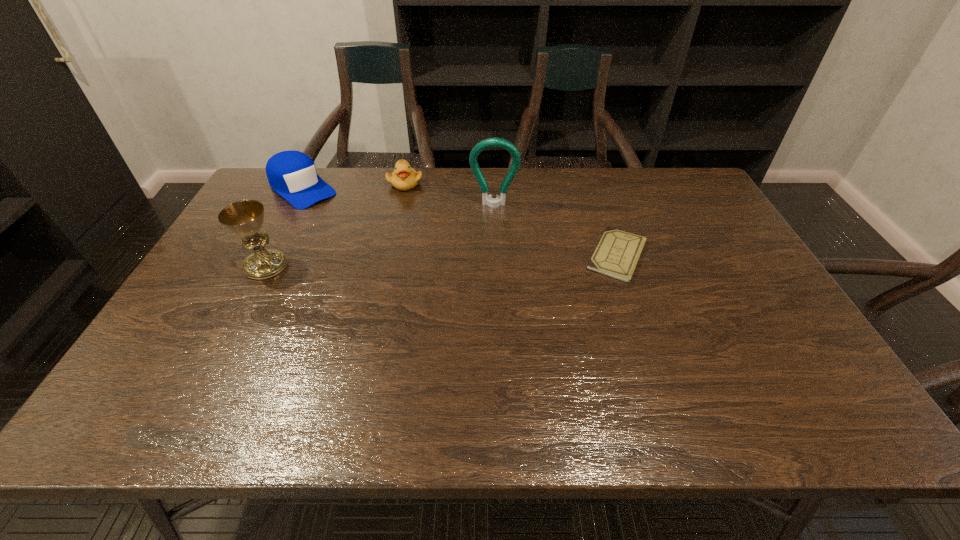
You are a GUI agent. You are given a task and a screenshot of the screen. Output one action in this format:
    pyautogui.click(x=<x>, y=<y>)
    Task: Click on the baseball cap at the far edge
    This screenshot has width=960, height=540.
    Given the screenshot: What is the action you would take?
    pyautogui.click(x=292, y=174)

You are a GUI agent. You are given a task and a screenshot of the screen. Output one action in this format:
    pyautogui.click(x=<x>, y=<y>)
    Task: Click on the bottle opener located at the far edge
    
    Given the screenshot: What is the action you would take?
    pyautogui.click(x=487, y=199)

At what (x,y) coordinates should I click in order to perform the action: click on chalice that is at the left edge. Please return your answer as a coordinate pair (x, y). The width and height of the screenshot is (960, 540). Looking at the image, I should click on (245, 218).

Find the location of a particular element. This screenshot has width=960, height=540. baseball cap that is at the left edge is located at coordinates (292, 174).

This screenshot has width=960, height=540. What are the coordinates of `object present at the far left corner` in the screenshot? It's located at (292, 174).

Locate an element on the screen. free space at the far edge is located at coordinates (426, 181).

The image size is (960, 540). In order to click on vacant area at the near edge of the desktop in this screenshot , I will do `click(528, 376)`.

Locate an element on the screen. free region at the left edge of the desktop is located at coordinates (234, 260).

Locate an element on the screen. vacant space at the right edge is located at coordinates (707, 211).

Find the location of a particular element. The height and width of the screenshot is (540, 960). vacant space at the near right corner of the desktop is located at coordinates (786, 348).